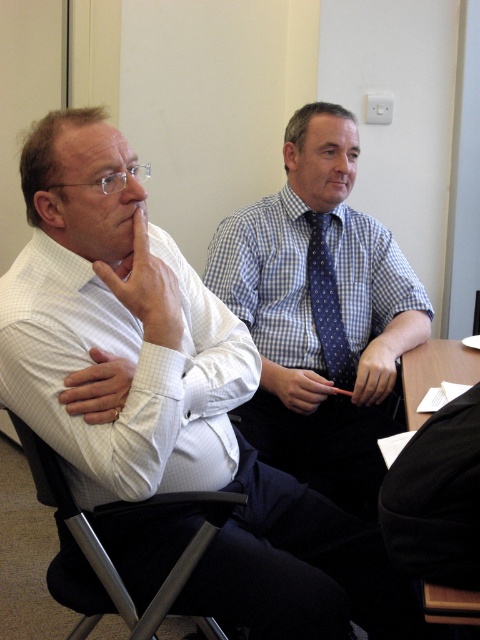
Which is behind, point (307, 173) or point (187, 579)?

The point (307, 173) is more distant.

Does blue checkered shirt at center have a greater width compared to metallic gray chair at lower left?

Indeed, blue checkered shirt at center has a greater width compared to metallic gray chair at lower left.

Between point (315, 403) and point (72, 502), which one is positioned in front?

Positioned in front is point (72, 502).

Locate an element on the screen. Image resolution: width=480 pixels, height=640 pixels. blue checkered shirt at center is located at coordinates [x=320, y=312].

Is point (437, 490) farther from camera compared to point (193, 536)?

No, (437, 490) is in front of (193, 536).

Who is lower down, black fabric at lower right or metallic gray chair at lower left?

Positioned lower is metallic gray chair at lower left.

The width and height of the screenshot is (480, 640). In order to click on black fabric at lower right in this screenshot , I will do `click(436, 497)`.

At what (x,y) coordinates should I click in order to perform the action: click on black fabric at lower right. Please return your answer as a coordinate pair (x, y). The height and width of the screenshot is (640, 480). Looking at the image, I should click on (436, 497).

Does metallic gray chair at lower left have a larger size compared to blue dotted fabric tie at center?

Yes.

Can you confirm if metallic gray chair at lower left is thinner than blue dotted fabric tie at center?

Incorrect, metallic gray chair at lower left's width is not less than blue dotted fabric tie at center's.

You are a GUI agent. You are given a task and a screenshot of the screen. Output one action in this format:
    pyautogui.click(x=<x>, y=<y>)
    Task: Click on the metallic gray chair at lower left
    This screenshot has height=640, width=480.
    Given the screenshot: What is the action you would take?
    pyautogui.click(x=122, y=515)